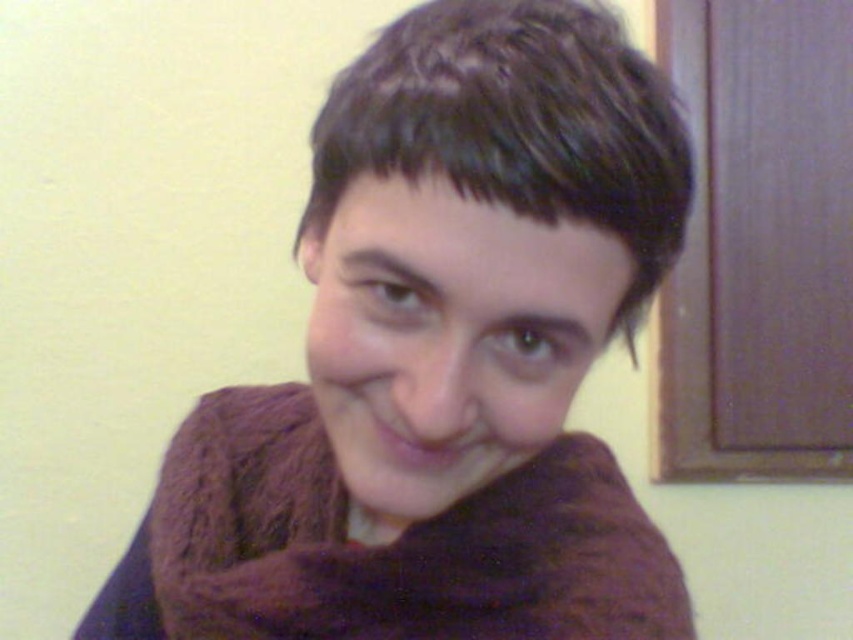
Question: Is purple knitted scarf at center behind brown fuzzy scarf at center?

Choices:
 (A) yes
 (B) no

Answer: (B)

Question: Does purple knitted scarf at center have a smaller size compared to brown fuzzy scarf at center?

Choices:
 (A) no
 (B) yes

Answer: (A)

Question: Among these points, which one is nearest to the camera?

Choices:
 (A) (491, 600)
 (B) (425, 148)

Answer: (B)

Question: Does purple knitted scarf at center lie behind brown fuzzy scarf at center?

Choices:
 (A) yes
 (B) no

Answer: (B)

Question: Which point is farther to the camera?

Choices:
 (A) purple knitted scarf at center
 (B) brown fuzzy scarf at center

Answer: (B)